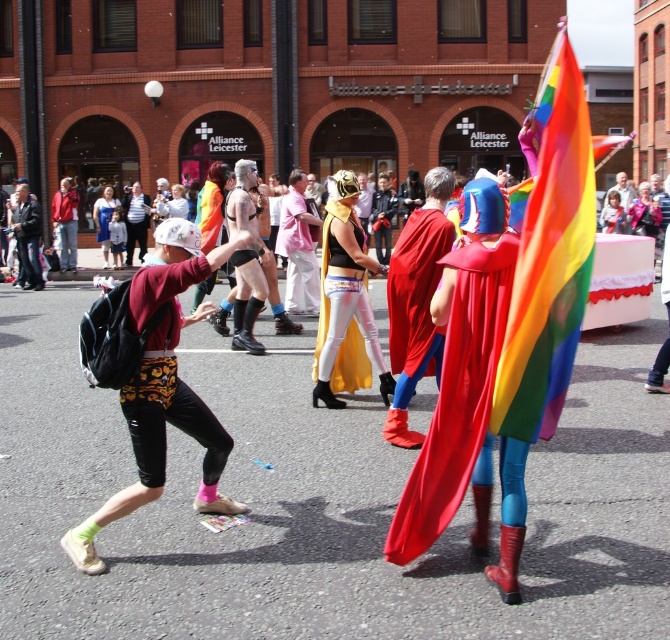
This screenshot has height=640, width=670. What do you see at coordinates (165, 378) in the screenshot?
I see `floral-patterned fabric at center` at bounding box center [165, 378].

Find the location of a particular element. This screenshot has height=640, width=670. floral-patterned fabric at center is located at coordinates (165, 378).

Does floral-patterned fabric at center lie in front of shiny red cape at center?

Yes.

Can you confirm if floral-patterned fabric at center is positioned below shiny red cape at center?

Indeed, floral-patterned fabric at center is positioned under shiny red cape at center.

In order to click on floral-patterned fabric at center in this screenshot , I will do `click(165, 378)`.

Who is higher up, printed fabric shorts at left or metallic gold mask at center?

Positioned higher is metallic gold mask at center.

Is printed fabric shorts at left wider than metallic gold mask at center?

Yes.

Locate an element on the screen. Image resolution: width=670 pixels, height=640 pixels. printed fabric shorts at left is located at coordinates (161, 388).

Where is `printed fabric shorts at left`? printed fabric shorts at left is located at coordinates (161, 388).